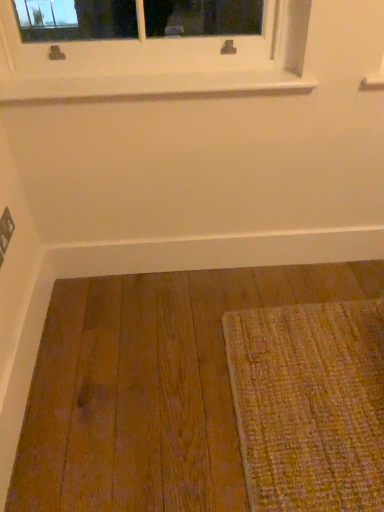
At what (x,y) coordinates should I click in order to perform the action: click on free space above white smooth baseboard at lower center (from a real-world perspective). Please return your answer as a coordinate pair (x, y). The height and width of the screenshot is (512, 384). Looking at the image, I should click on (220, 228).